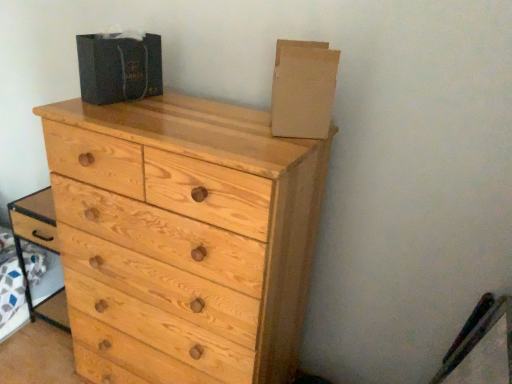
This screenshot has height=384, width=512. I want to click on free point above light wood chest of drawers at center (from a real-world perspective), so click(x=196, y=119).